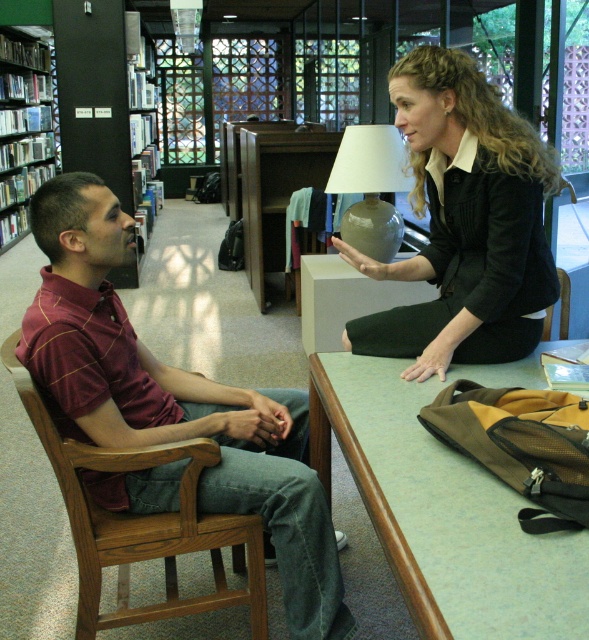
In the scene shown: Is maroon striped shirt at left behind matte ceramic lamp at center?

No.

Can you confirm if maroon striped shirt at left is thinner than matte ceramic lamp at center?

In fact, maroon striped shirt at left might be wider than matte ceramic lamp at center.

Locate an element on the screen. The height and width of the screenshot is (640, 589). maroon striped shirt at left is located at coordinates [x=173, y=401].

Can you confirm if maroon striped shirt at left is taller than green laminate table at center?

Yes.

Between point (102, 266) and point (530, 625), which one is positioned in front?

Point (530, 625)

Find the location of a particular element. maroon striped shirt at left is located at coordinates (173, 401).

Who is positioned more to the right, matte plastic bookshelf at left or matte ceramic lamp at center?

matte ceramic lamp at center

Who is more distant from viewer, [54,109] or [359,212]?

Positioned behind is point [54,109].

Image resolution: width=589 pixels, height=640 pixels. What do you see at coordinates (24, 125) in the screenshot?
I see `matte plastic bookshelf at left` at bounding box center [24, 125].

This screenshot has width=589, height=640. What are the coordinates of `matte plastic bookshelf at left` in the screenshot? It's located at (24, 125).